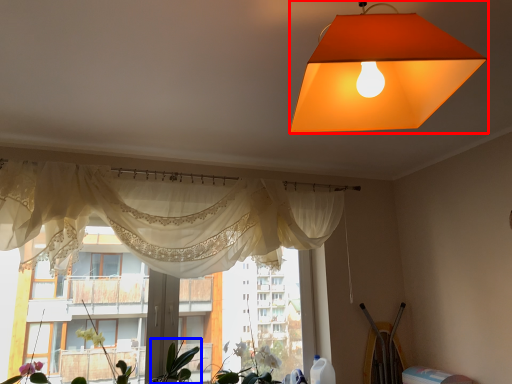
Question: Among these objects, which one is nearest to the camera, lamp (highlighted by a red box) or plant (highlighted by a blue box)?

Choices:
 (A) lamp
 (B) plant

Answer: (A)